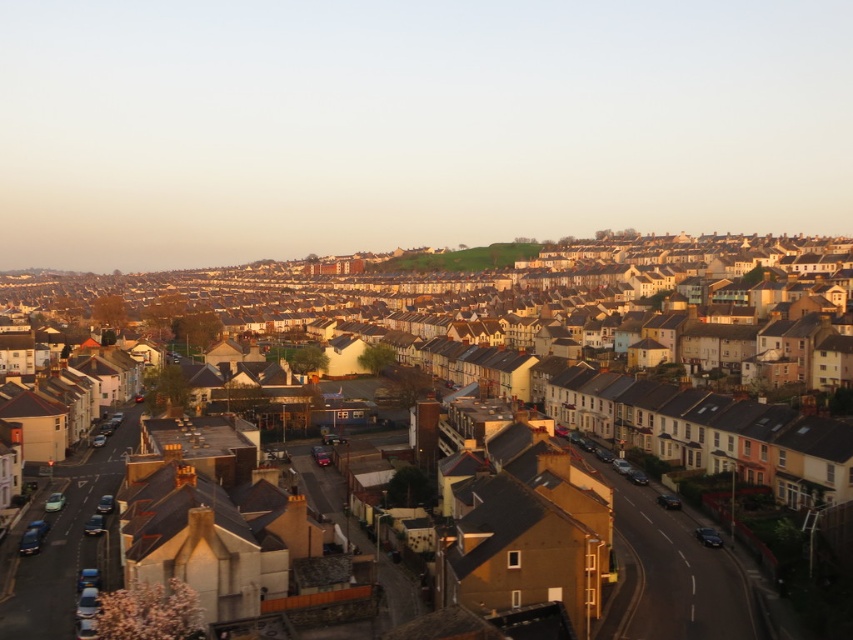
Question: Can you confirm if white matte houses at center is positioned to the left of green grassy hill at center?

Choices:
 (A) no
 (B) yes

Answer: (B)

Question: Which object is farther from the camera taking this photo?

Choices:
 (A) green grassy hill at center
 (B) white matte houses at center

Answer: (A)

Question: Where is white matte houses at center located in relation to green grassy hill at center in the image?

Choices:
 (A) right
 (B) left

Answer: (B)

Question: Does white matte houses at center lie in front of green grassy hill at center?

Choices:
 (A) no
 (B) yes

Answer: (B)